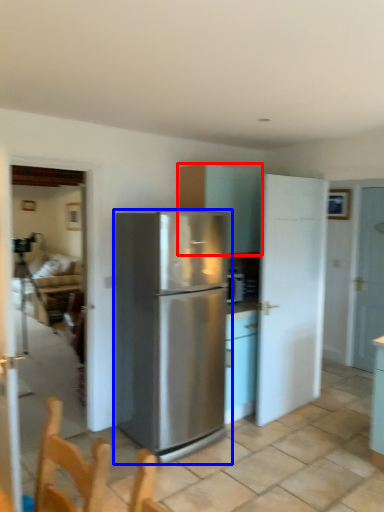
Question: Which object appears closest to the camera in this image, cabinetry (highlighted by a red box) or refrigerator (highlighted by a blue box)?

Choices:
 (A) cabinetry
 (B) refrigerator

Answer: (B)